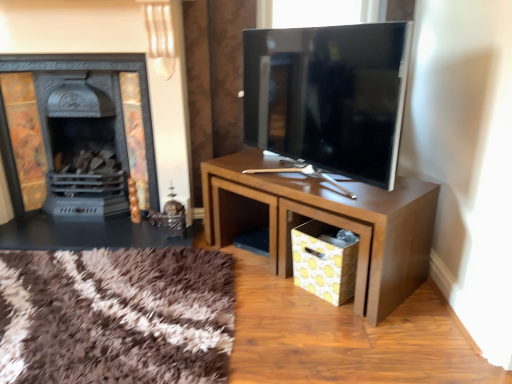
Question: Considering the relative sizes of matte black tv at center and black matte fireplace at left in the image provided, is matte black tv at center bigger than black matte fireplace at left?

Choices:
 (A) no
 (B) yes

Answer: (A)

Question: Can you confirm if matte black tv at center is positioned to the left of black matte fireplace at left?

Choices:
 (A) yes
 (B) no

Answer: (B)

Question: From a real-world perspective, does matte black tv at center sit lower than black matte fireplace at left?

Choices:
 (A) yes
 (B) no

Answer: (B)

Question: Considering the relative sizes of matte black tv at center and black matte fireplace at left in the image provided, is matte black tv at center smaller than black matte fireplace at left?

Choices:
 (A) no
 (B) yes

Answer: (B)

Question: Is matte black tv at center positioned before black matte fireplace at left?

Choices:
 (A) yes
 (B) no

Answer: (A)

Question: Is matte black tv at center positioned with its back to black matte fireplace at left?

Choices:
 (A) yes
 (B) no

Answer: (B)

Question: Is brown wood table at center located outside black matte fireplace at left?

Choices:
 (A) yes
 (B) no

Answer: (A)

Question: Is brown wood table at center to the right of black matte fireplace at left from the viewer's perspective?

Choices:
 (A) no
 (B) yes

Answer: (B)

Question: Does brown wood table at center have a larger size compared to black matte fireplace at left?

Choices:
 (A) yes
 (B) no

Answer: (B)

Question: From the image's perspective, is brown wood table at center on black matte fireplace at left?

Choices:
 (A) no
 (B) yes

Answer: (A)

Question: Is brown wood table at center placed right next to black matte fireplace at left?

Choices:
 (A) yes
 (B) no

Answer: (B)

Question: Is black matte fireplace at left surrounded by brown wood table at center?

Choices:
 (A) yes
 (B) no

Answer: (B)

Question: From a real-world perspective, is black matte fireplace at left positioned under matte black tv at center based on gravity?

Choices:
 (A) yes
 (B) no

Answer: (A)